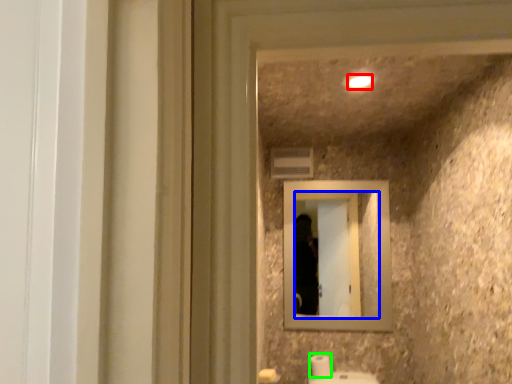
Question: Based on their relative distances, which object is nearer to light (highlighted by a red box)? Choose from mirror (highlighted by a blue box) and toilet paper (highlighted by a green box).

Choices:
 (A) mirror
 (B) toilet paper

Answer: (B)